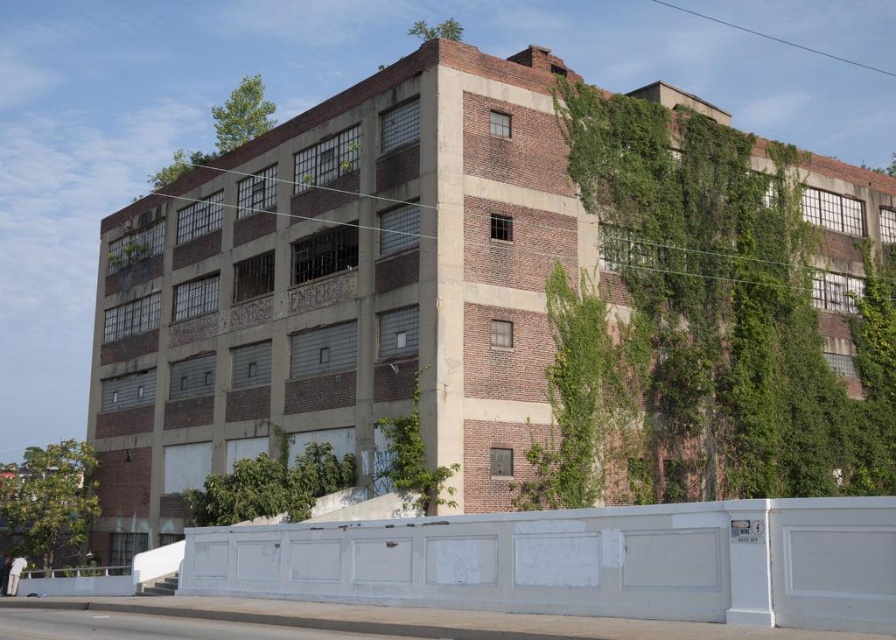
In the scene shown: Who is taller, green leafy plant at lower left or green leafy vines at center?

green leafy vines at center

From the picture: Is green leafy plant at lower left to the right of green leafy vines at center from the viewer's perspective?

Incorrect, green leafy plant at lower left is not on the right side of green leafy vines at center.

Identify the location of green leafy plant at lower left. This screenshot has width=896, height=640. (270, 486).

Which is behind, point (48, 564) or point (419, 497)?

Positioned behind is point (48, 564).

Is green leafy tree at lower left bigger than green leafy vines at center?

Indeed, green leafy tree at lower left has a larger size compared to green leafy vines at center.

I want to click on green leafy tree at lower left, so click(x=48, y=500).

Image resolution: width=896 pixels, height=640 pixels. What are the coordinates of `green leafy tree at lower left` in the screenshot? It's located at (48, 500).

Which is behind, point (42, 512) or point (194, 502)?

The point (42, 512) is behind.

Who is positioned more to the right, green leafy tree at lower left or green leafy plant at lower left?

From the viewer's perspective, green leafy plant at lower left appears more on the right side.

Who is more distant from viewer, (70, 502) or (225, 496)?

The point (70, 502) is more distant.

Find the location of a particular element. green leafy tree at lower left is located at coordinates (48, 500).